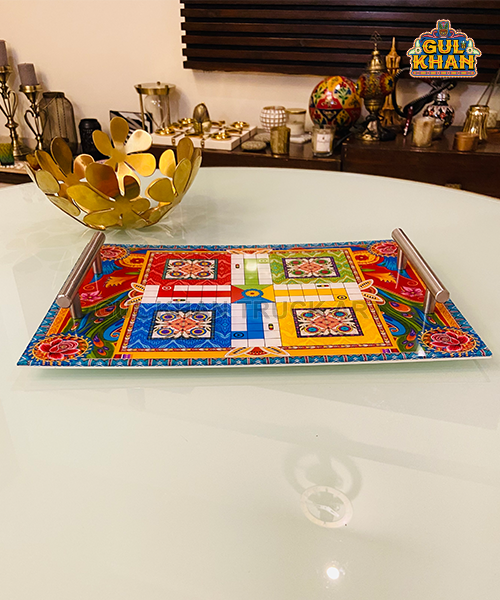
Identify the location of game board. (248, 322).